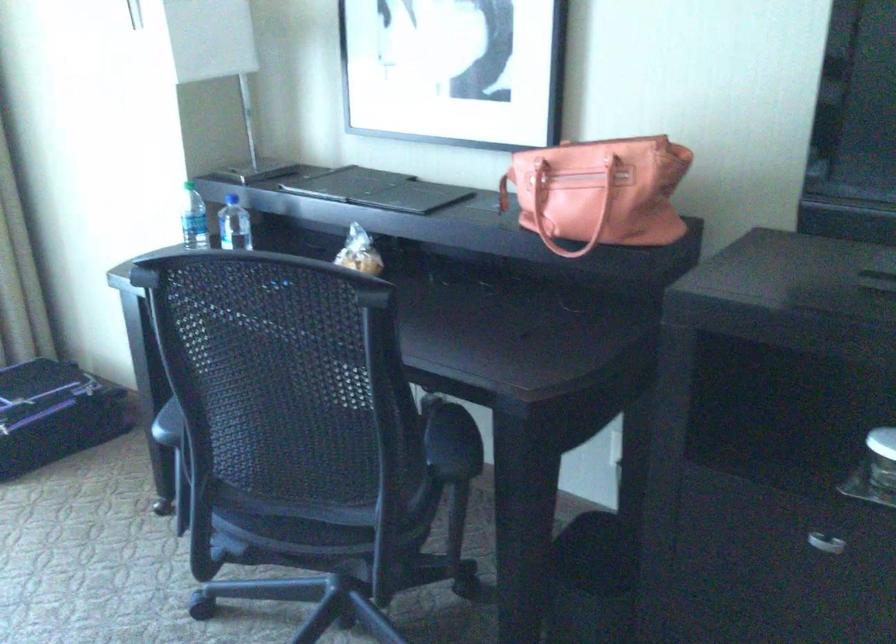
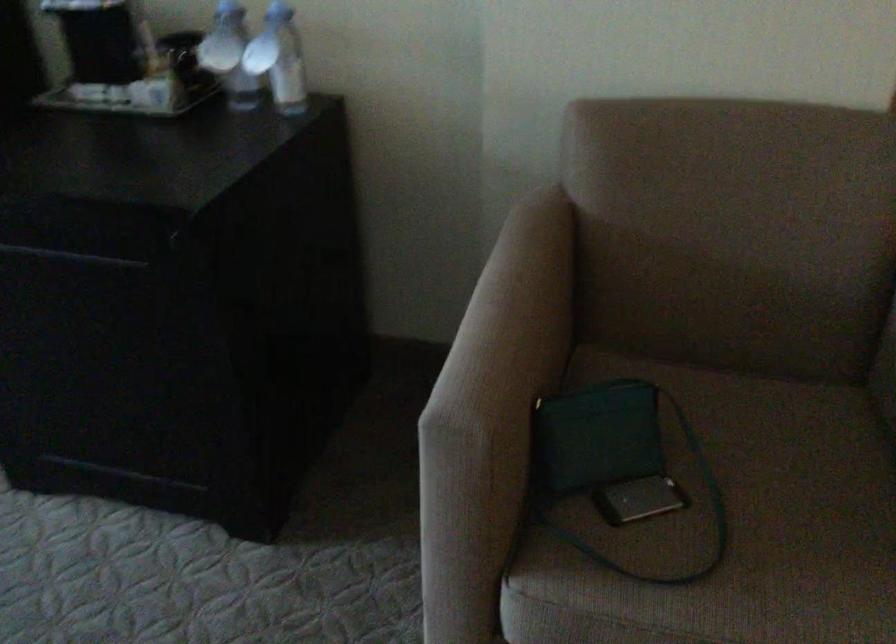
Based on the photo, in a continuous first-person perspective shot, in which direction is the camera moving?

The movement direction of the cameraman is right, backward.